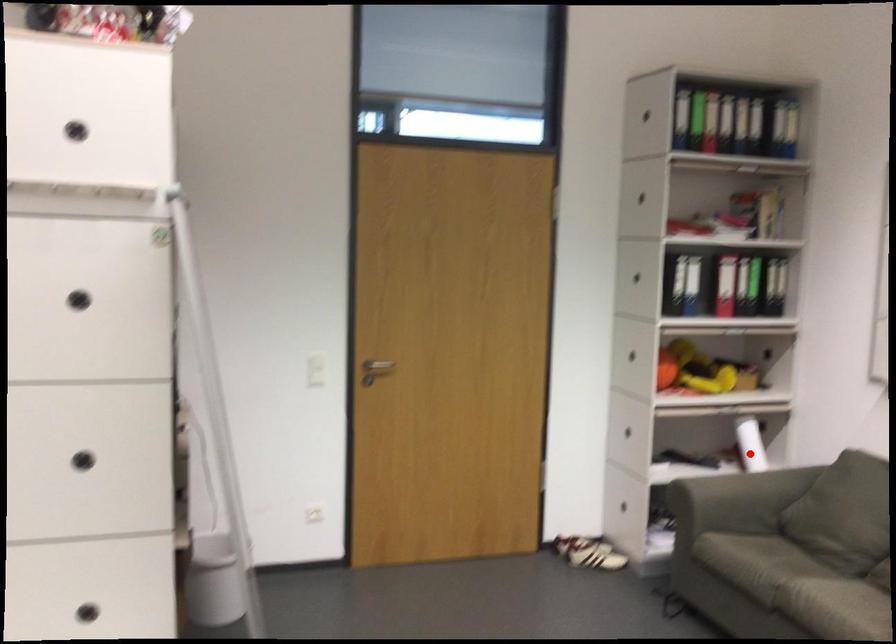
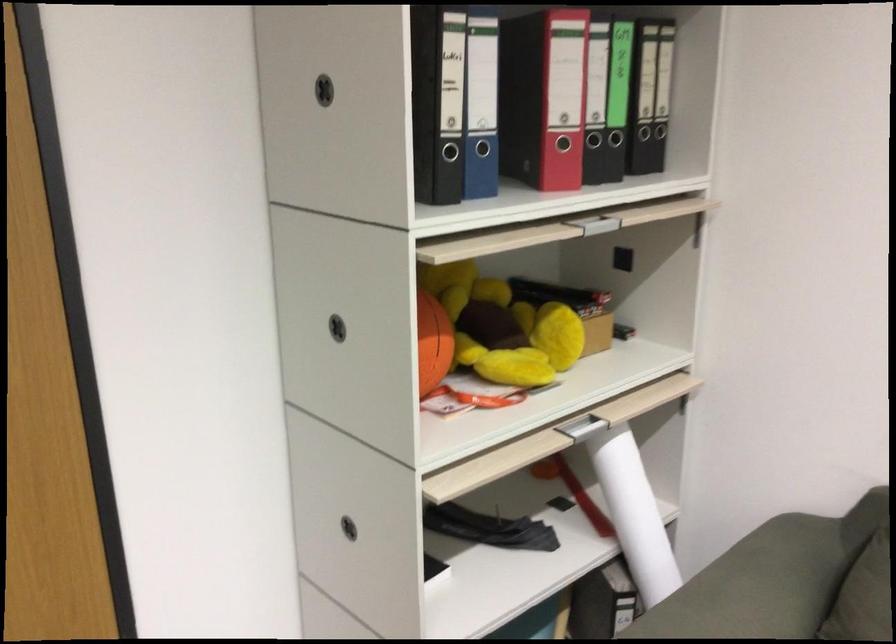
Question: I am providing you with two images of the same scene from different viewpoints. In image1, a red point is highlighted. Considering the same 3D point in image2, which of the following is correct?

Choices:
 (A) It is closer
 (B) It is farther

Answer: (A)